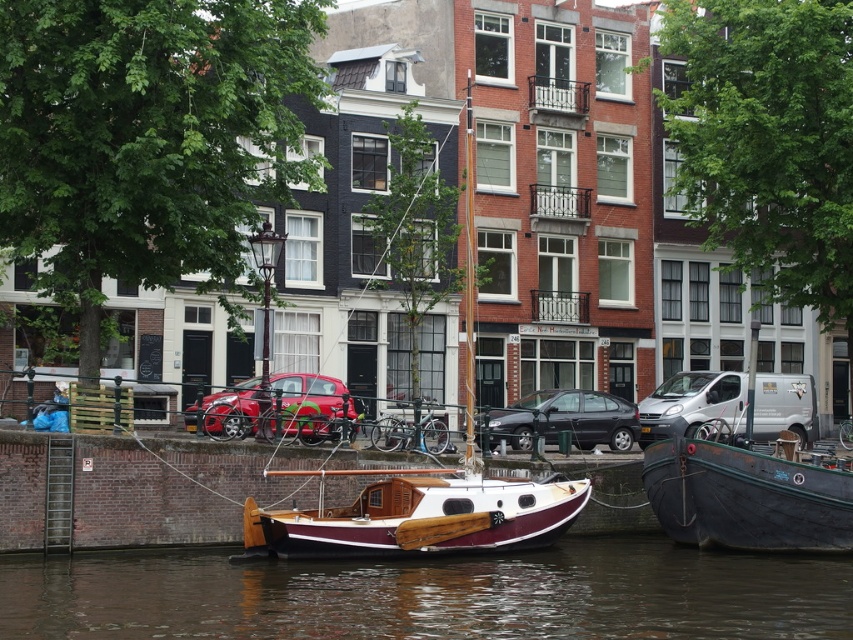
Is metallic red car at center to the right of black matte car at center from the viewer's perspective?

Incorrect, metallic red car at center is not on the right side of black matte car at center.

Is point (285, 417) behind point (509, 433)?

No, (285, 417) is closer to viewer.

Who is more forward, [346,397] or [607,396]?

Point [346,397]

Image resolution: width=853 pixels, height=640 pixels. I want to click on metallic red car at center, so click(312, 406).

Which is above, wooden polished boat at center or silver metallic van at center-right?

Positioned higher is silver metallic van at center-right.

The height and width of the screenshot is (640, 853). Describe the element at coordinates (418, 515) in the screenshot. I see `wooden polished boat at center` at that location.

At what (x,y) coordinates should I click in order to perform the action: click on wooden polished boat at center. Please return your answer as a coordinate pair (x, y). Looking at the image, I should click on (418, 515).

Between point (309, 516) and point (676, 426), which one is positioned in front?

Positioned in front is point (309, 516).

Looking at this image, is wooden sailboat at center positioned before silver metallic van at center-right?

Yes, wooden sailboat at center is closer to the viewer.

Where is `wooden sailboat at center`? The height and width of the screenshot is (640, 853). wooden sailboat at center is located at coordinates (422, 490).